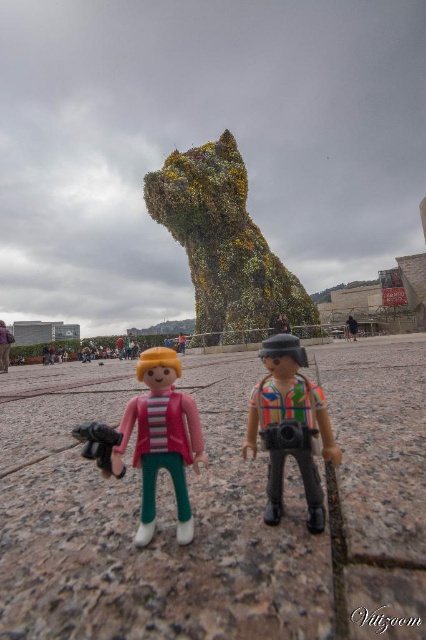
Question: In this image, where is multicolored fabric camera at center located relative to pink plastic figure at center?

Choices:
 (A) above
 (B) below

Answer: (A)

Question: Is pink plastic figure at center to the right of matte pink jacket at lower left from the viewer's perspective?

Choices:
 (A) yes
 (B) no

Answer: (A)

Question: Does multicolored fabric camera at center appear on the right side of pink plastic figure at center?

Choices:
 (A) yes
 (B) no

Answer: (A)

Question: Which of these objects is positioned farthest from the multicolored striped shirt at center?

Choices:
 (A) green leafy sculpture at center
 (B) matte pink jacket at lower left

Answer: (B)

Question: Among these points, which one is nearest to the camera?

Choices:
 (A) (305, 388)
 (B) (218, 272)
 (C) (8, 358)

Answer: (A)

Question: Which point appears farthest from the camera in this image?

Choices:
 (A) (215, 296)
 (B) (354, 326)
 (C) (279, 433)
 (D) (3, 369)

Answer: (B)